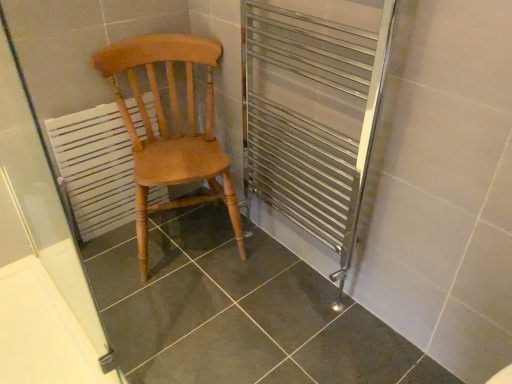
Locate an element on the screen. unoccupied area behind white matte screen door at left is located at coordinates (150, 269).